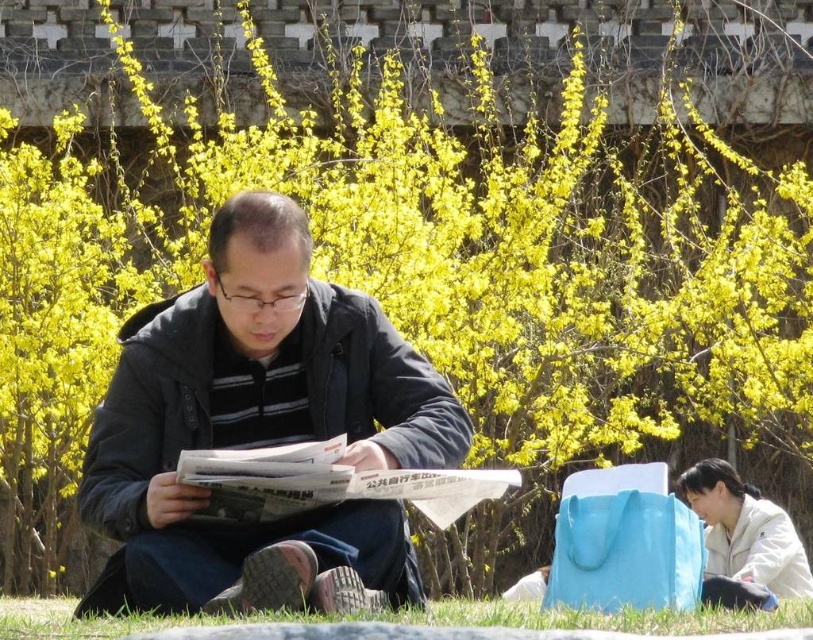
You are a photographer trying to capture a candid shot of the man reading his newspaper in the park. You want to ensure the dark blue jacket at center and the white glossy newspaper at center are both clearly visible in the frame. Based on their positions, which object should you focus on first to ensure both are in focus?

The dark blue jacket at center is positioned on the left side of the white glossy newspaper at center. To ensure both are in focus, you should focus on the dark blue jacket at center first since it is closer to the camera, allowing the newspaper to fall within the depth of field.

You are standing in the park and see the dark blue jacket at center and the green grass at lower center. Which object is closer to you?

The dark blue jacket at center is closer to you because it is further to the viewer than the green grass at lower center.

You are standing in the park and see the dark blue jacket at center and the green grass at lower center. Which object is positioned to the right side of the other?

The green grass at lower center is positioned to the right of the dark blue jacket at center.